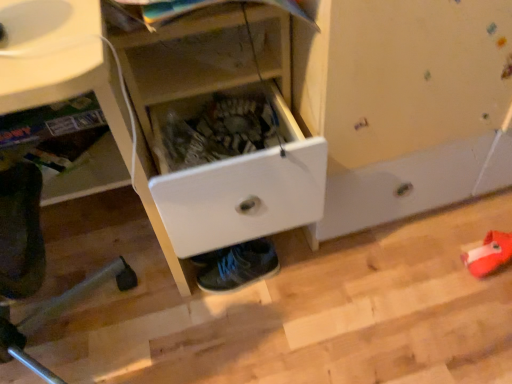
Find the location of `free space between white plastic drawer at lower center and white plastic drawer at center`. free space between white plastic drawer at lower center and white plastic drawer at center is located at coordinates (178, 303).